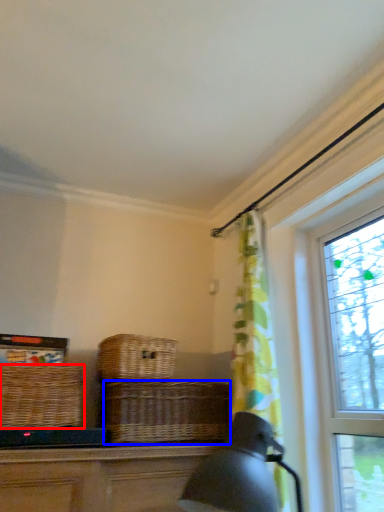
Question: Which point is further to the camera, picnic basket (highlighted by a red box) or basket (highlighted by a blue box)?

Choices:
 (A) picnic basket
 (B) basket

Answer: (B)